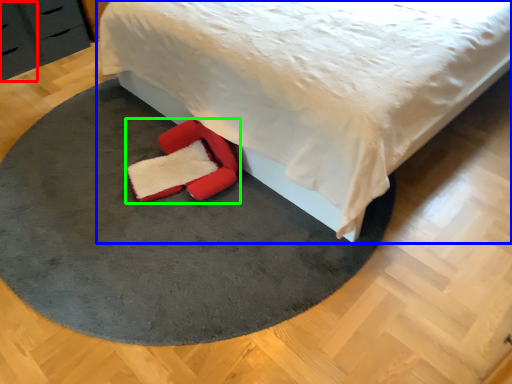
Question: Which object is positioned farthest from drawer (highlighted by a red box)? Select from bed (highlighted by a blue box) and footwear (highlighted by a green box).

Choices:
 (A) bed
 (B) footwear

Answer: (A)